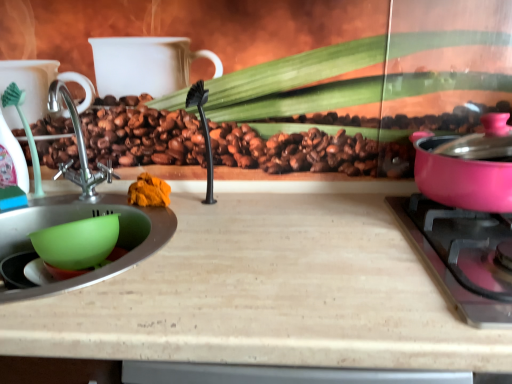
In order to face pink glossy pot at right, should I rotate leftwards or rightwards?

To align with it, rotate right about 28.307°.

Locate an element on the screen. This screenshot has width=512, height=384. green plastic mixing bowl at lower left is located at coordinates (77, 242).

Looking at this image, is pink glossy pot at right thinner than wooden cutting board at center?

Indeed, pink glossy pot at right has a lesser width compared to wooden cutting board at center.

Is pink glossy pot at right surrounding wooden cutting board at center?

That's incorrect, wooden cutting board at center is not inside pink glossy pot at right.

How far apart are pink glossy pot at right and wooden cutting board at center?

They are 7.42 inches apart.

Is pink glossy pot at right not near pink glossy pot at right?

No.

Which is closer, (486, 282) or (444, 169)?

Point (486, 282) is closer to the camera than point (444, 169).

Is pink glossy pot at right located within pink glossy pot at right?

That's incorrect, pink glossy pot at right is not inside pink glossy pot at right.

Is pink glossy pot at right looking in the opposite direction of pink glossy pot at right?

pink glossy pot at right is not turned away from pink glossy pot at right.

Can you tell me how much wooden cutting board at center and pink glossy pot at right differ in facing direction?

0.000306 degrees separate the facing orientations of wooden cutting board at center and pink glossy pot at right.

Is wooden cutting board at center in front of or behind pink glossy pot at right in the image?

Clearly, wooden cutting board at center is in front of pink glossy pot at right.

Considering the sizes of wooden cutting board at center and pink glossy pot at right in the image, is wooden cutting board at center taller or shorter than pink glossy pot at right?

Clearly, wooden cutting board at center is taller compared to pink glossy pot at right.

In terms of width, does wooden cutting board at center look wider or thinner when compared to pink glossy pot at right?

wooden cutting board at center is wider than pink glossy pot at right.

Is there a large distance between green plastic mixing bowl at lower left and pink glossy pot at right?

green plastic mixing bowl at lower left is near pink glossy pot at right, not far away.

Which object is positioned more to the right, green plastic mixing bowl at lower left or pink glossy pot at right?

pink glossy pot at right is more to the right.

Between green plastic mixing bowl at lower left and pink glossy pot at right, which one has more height?

With more height is pink glossy pot at right.

From a real-world perspective, is green plastic mixing bowl at lower left under wooden cutting board at center?

Actually, green plastic mixing bowl at lower left is physically above wooden cutting board at center in the real world.

What are the coordinates of `mixing bowl above the wooden cutting board at center (from the image's perspective)` in the screenshot? It's located at (77, 242).

Is green plastic mixing bowl at lower left closer to the viewer compared to wooden cutting board at center?

No, it is not.

From the picture: Considering the sizes of wooden cutting board at center and pink glossy pot at right in the image, is wooden cutting board at center wider or thinner than pink glossy pot at right?

In the image, wooden cutting board at center appears to be wider than pink glossy pot at right.

Which is closer, (x=277, y=271) or (x=475, y=201)?

Point (x=277, y=271) is closer to the camera than point (x=475, y=201).

From the image's perspective, between wooden cutting board at center and pink glossy pot at right, who is located below?

wooden cutting board at center is shown below in the image.

Between wooden cutting board at center and pink glossy pot at right, which one has more height?

wooden cutting board at center.

Which object is further away from the camera, pink glossy pot at right or green plastic mixing bowl at lower left?

Positioned behind is green plastic mixing bowl at lower left.

From a real-world perspective, is pink glossy pot at right above or below green plastic mixing bowl at lower left?

In terms of real-world spatial position, pink glossy pot at right is above green plastic mixing bowl at lower left.

From the image's perspective, who appears lower, pink glossy pot at right or green plastic mixing bowl at lower left?

From the image's view, green plastic mixing bowl at lower left is below.

Where is `counter top on the left of pink glossy pot at right`? This screenshot has width=512, height=384. counter top on the left of pink glossy pot at right is located at coordinates (266, 294).

I want to click on gas stove directly beneath the pink glossy pot at right (from a real-world perspective), so click(462, 256).

Estimate the real-world distances between objects in this image. Which object is further from green plastic mixing bowl at lower left, pink glossy pot at right or pink glossy pot at right?

Based on the image, pink glossy pot at right appears to be further to green plastic mixing bowl at lower left.

From the image, which object appears to be nearer to pink glossy pot at right, wooden cutting board at center or green plastic mixing bowl at lower left?

wooden cutting board at center is closer to pink glossy pot at right.

From the image, which object appears to be nearer to pink glossy pot at right, wooden cutting board at center or pink glossy pot at right?

Among the two, pink glossy pot at right is located nearer to pink glossy pot at right.

When comparing their distances from wooden cutting board at center, does green plastic mixing bowl at lower left or pink glossy pot at right seem further?

Based on the image, green plastic mixing bowl at lower left appears to be further to wooden cutting board at center.

From the image, which object appears to be nearer to pink glossy pot at right, green plastic mixing bowl at lower left or pink glossy pot at right?

pink glossy pot at right.

When comparing their distances from green plastic mixing bowl at lower left, does pink glossy pot at right or wooden cutting board at center seem further?

pink glossy pot at right is further to green plastic mixing bowl at lower left.

From the picture: Considering their positions, is pink glossy pot at right positioned further to green plastic mixing bowl at lower left than pink glossy pot at right?

pink glossy pot at right is further to green plastic mixing bowl at lower left.

Estimate the real-world distances between objects in this image. Which object is further from pink glossy pot at right, pink glossy pot at right or wooden cutting board at center?

wooden cutting board at center is positioned further to the anchor pink glossy pot at right.

The image size is (512, 384). Find the location of `gas stove located between green plastic mixing bowl at lower left and pink glossy pot at right in the left-right direction`. gas stove located between green plastic mixing bowl at lower left and pink glossy pot at right in the left-right direction is located at coordinates (462, 256).

Locate an element on the screen. This screenshot has width=512, height=384. counter top between green plastic mixing bowl at lower left and pink glossy pot at right is located at coordinates (266, 294).

The image size is (512, 384). In order to click on counter top between green plastic mixing bowl at lower left and pink glossy pot at right in this screenshot , I will do [x=266, y=294].

The width and height of the screenshot is (512, 384). In order to click on gas stove between pink glossy pot at right and wooden cutting board at center vertically in this screenshot , I will do `click(462, 256)`.